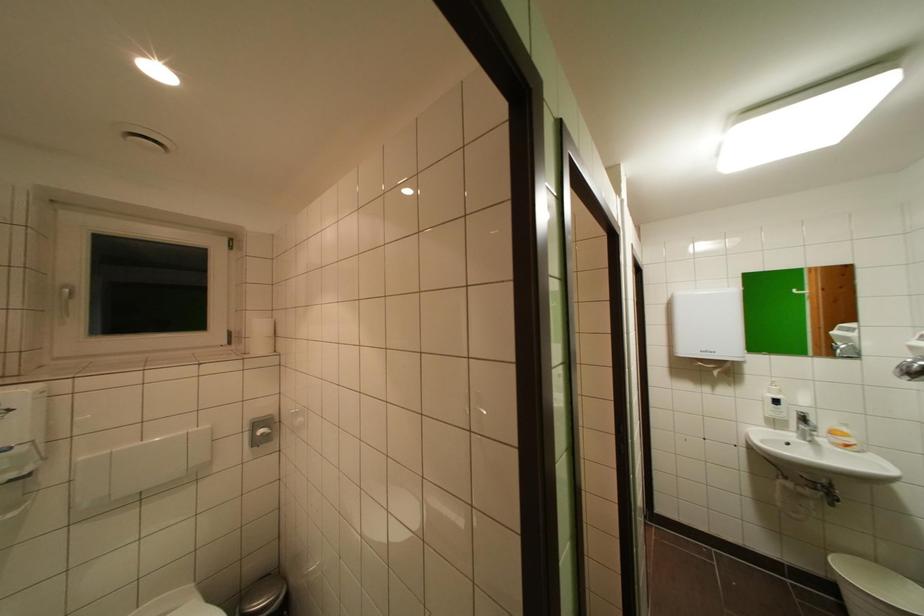
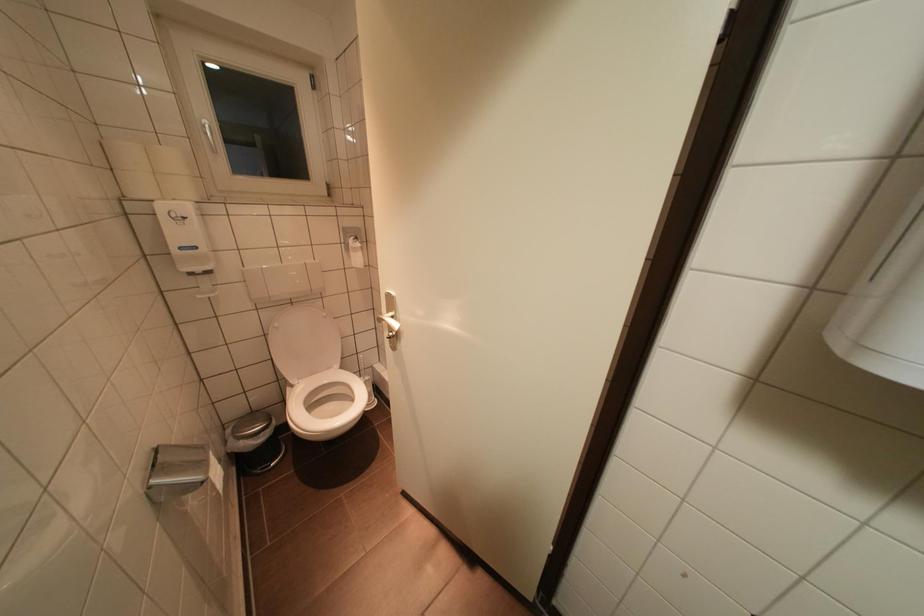
The images are taken continuously from a first-person perspective. In which direction are you moving?

The cameraman moved toward right, forward.